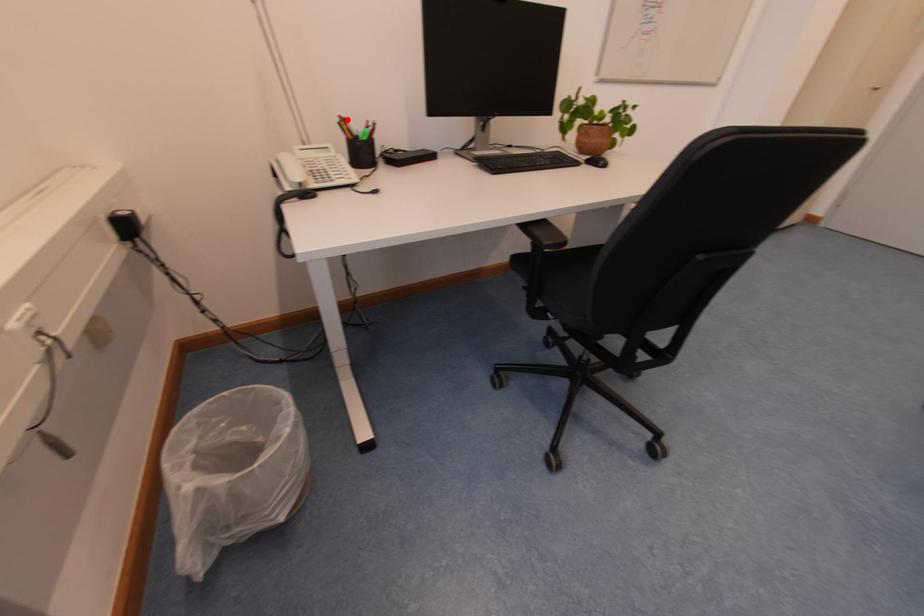
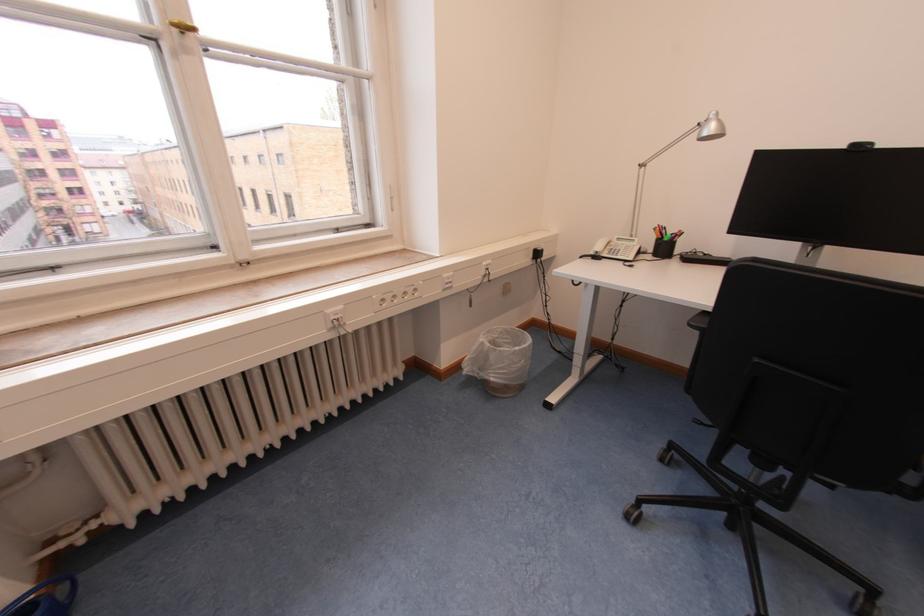
Find the pixel in the second image that matches the highlighted location in the first image.

(665, 228)